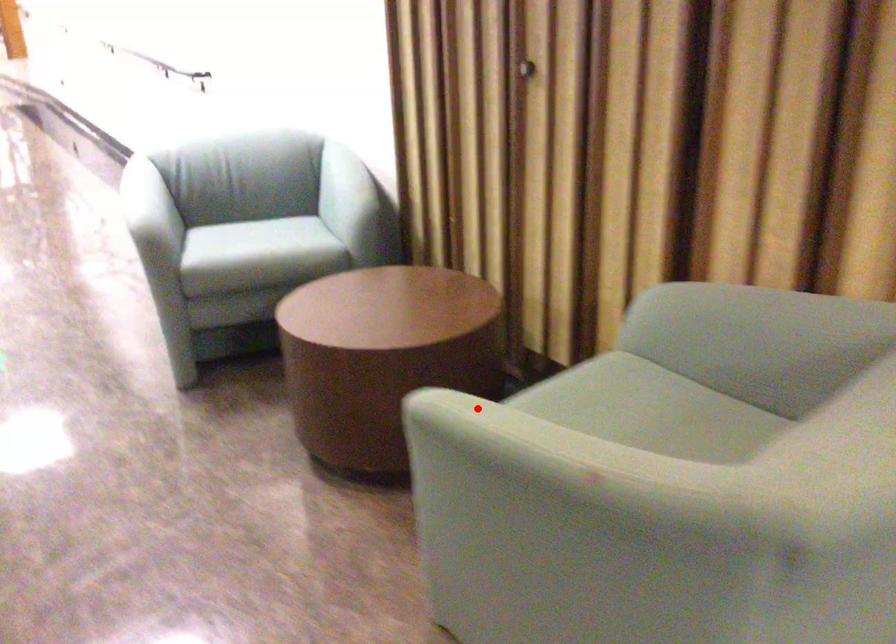
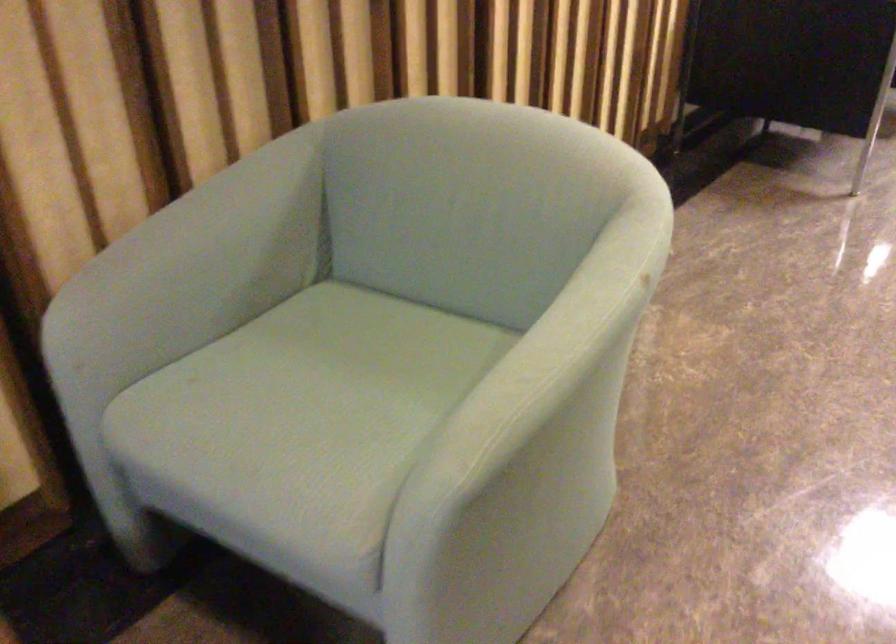
In the second image, find the point that corresponds to the highlighted location in the first image.

(533, 375)